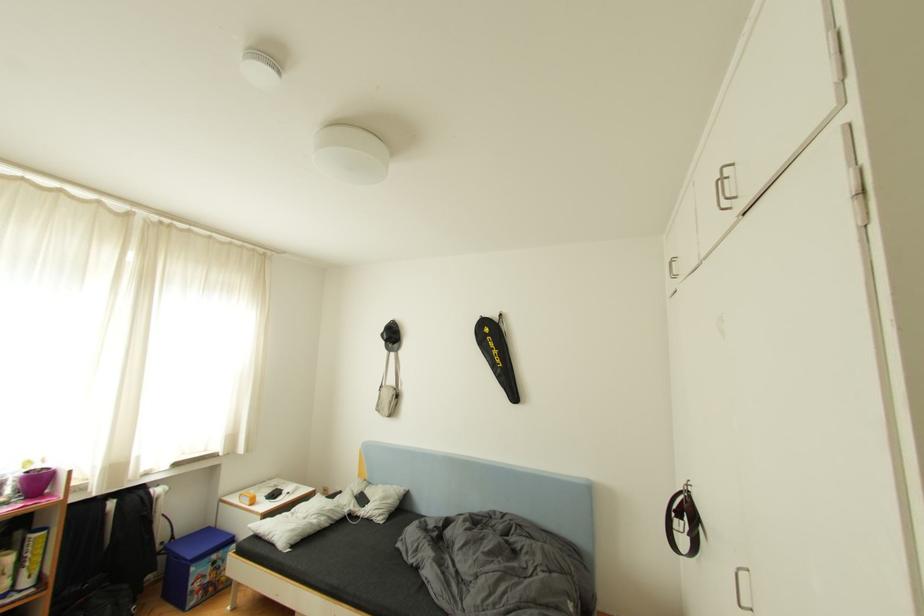
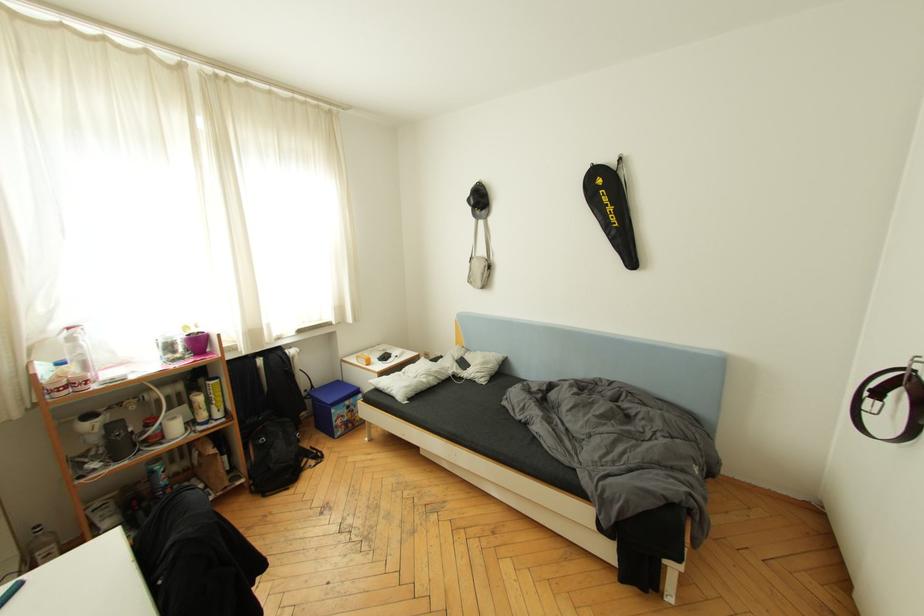
Question: Based on the continuous images, in which direction is the camera rotating? Reply with the corresponding letter.

Choices:
 (A) Left
 (B) Right
 (C) Up
 (D) Down

Answer: (D)